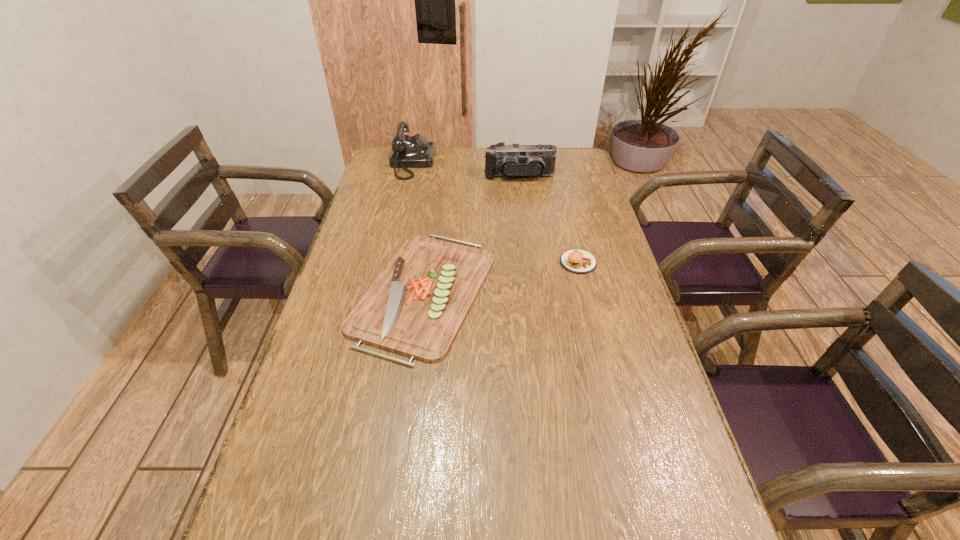
Find the location of `free space between the second shortest object and the telephone`. free space between the second shortest object and the telephone is located at coordinates (495, 213).

Where is `empty location between the camcorder and the second shortest object`? The image size is (960, 540). empty location between the camcorder and the second shortest object is located at coordinates [549, 219].

What are the coordinates of `free area in between the telephone and the chopping board` in the screenshot? It's located at (419, 227).

At what (x,y) coordinates should I click in order to perform the action: click on free spot between the telephone and the chopping board. Please return your answer as a coordinate pair (x, y). Image resolution: width=960 pixels, height=540 pixels. Looking at the image, I should click on (419, 227).

The width and height of the screenshot is (960, 540). I want to click on free space between the shortest object and the second shortest object, so click(501, 277).

Locate an element on the screen. free spot between the chopping board and the camcorder is located at coordinates (471, 234).

Select which object is the closest to the shortest object. Please provide its 2D coordinates. Your answer should be formatted as a tuple, i.e. [(x, y)], where the tuple contains the x and y coordinates of a point satisfying the conditions above.

[(578, 261)]

Find the location of a particular element. The image size is (960, 540). object identified as the closest to the patty is located at coordinates coord(417,305).

The height and width of the screenshot is (540, 960). Find the location of `free space that satisfies the following two spatial constraints: 1. on the dial of the chopping board; 2. on the right side of the telephone`. free space that satisfies the following two spatial constraints: 1. on the dial of the chopping board; 2. on the right side of the telephone is located at coordinates (383, 292).

Locate an element on the screen. This screenshot has height=540, width=960. free space that satisfies the following two spatial constraints: 1. on the back side of the chopping board; 2. on the dial of the telephone is located at coordinates (442, 163).